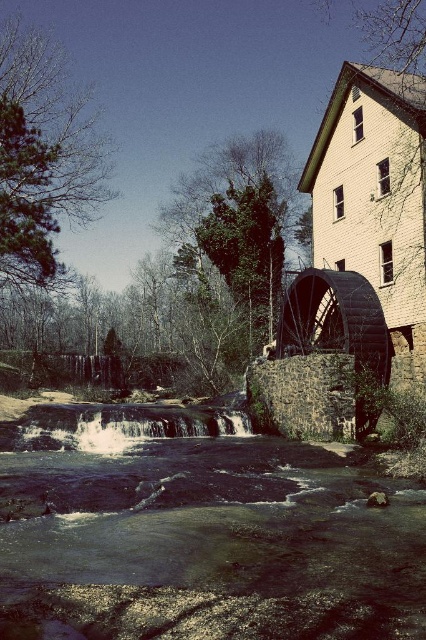
Looking at this image, you are a photographer planning to capture the flowing river in the scene. You notice the dark blue water at center and the white frothy water at lower center. Which area would you focus on if you want to highlight the calmest part of the river?

The dark blue water at center is larger in size than the white frothy water at lower center, suggesting it is calmer and more reflective, making it ideal for highlighting the calmest part of the river.

You are standing on the riverbank and see the dark blue water at center and the white frothy water at lower center. Which one is closer to you?

The white frothy water at lower center is closer to you because it is positioned below the dark blue water at center, which is located above it.

You are standing at the riverbank and want to take a photo of a specific point in the river. The point you want to capture is located at coordinates point (206,595). If your camera has a depth of field that can focus clearly up to 20 feet, will the point be in focus?

The distance of point (206,595) from the camera is 20.51 feet, which is slightly beyond the camera lens focus range of 20 feet. Therefore, the point will not be in focus.